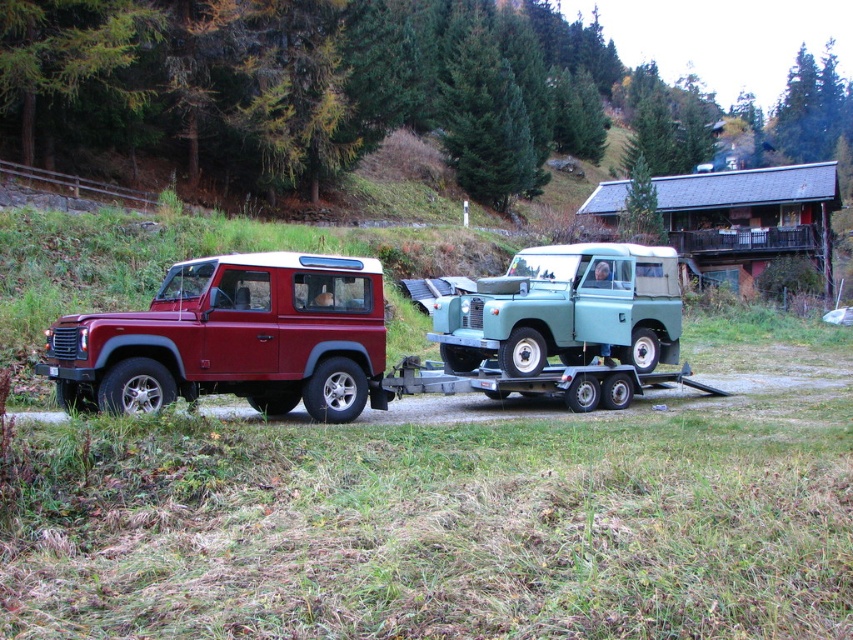
Locate an element on the screen. The width and height of the screenshot is (853, 640). matte red tow truck at left is located at coordinates (376, 333).

Can you confirm if matte red tow truck at left is bigger than light green matte jeep at center?

Incorrect, matte red tow truck at left is not larger than light green matte jeep at center.

What do you see at coordinates (376, 333) in the screenshot? This screenshot has height=640, width=853. I see `matte red tow truck at left` at bounding box center [376, 333].

This screenshot has height=640, width=853. I want to click on matte red tow truck at left, so click(x=376, y=333).